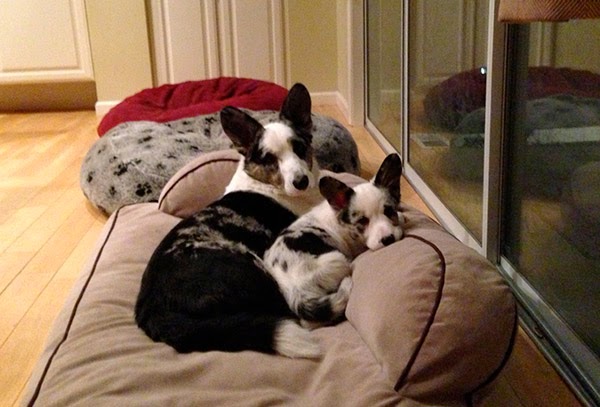
At what (x,y) coordinates should I click in order to perform the action: click on floor pillow. Please return your answer as a coordinate pair (x, y). Looking at the image, I should click on point(304,370).